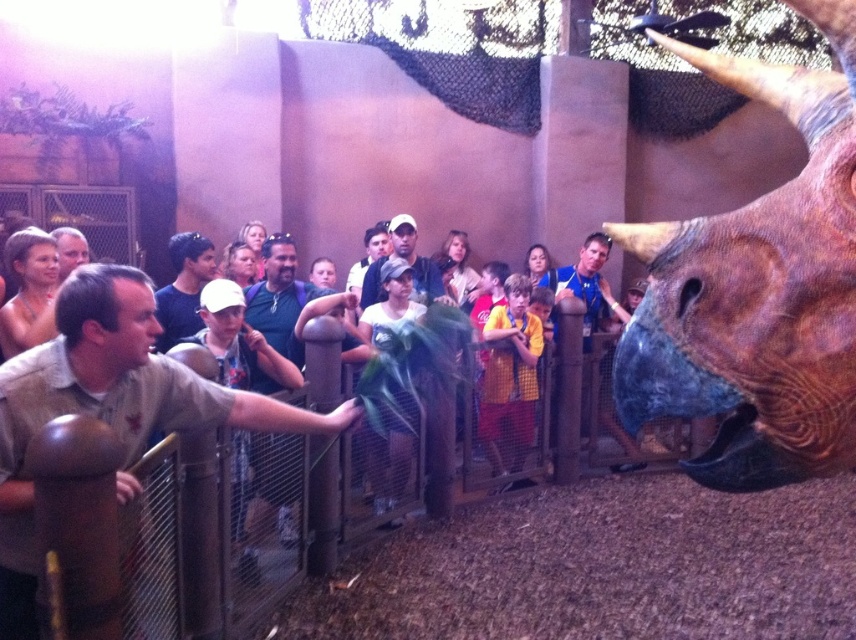
You are a visitor at the dinosaur exhibit. You notice the rustic brown horned head at right and the yellow shirt at center. Which object is located higher in the image?

The rustic brown horned head at right is positioned over the yellow shirt at center, so it is higher.

You are a visitor at the dinosaur exhibit. You notice the rustic brown horned head at right and the light brown shirt at center. Which object is positioned higher in the image?

The rustic brown horned head at right is located above the light brown shirt at center, so it is positioned higher in the image.